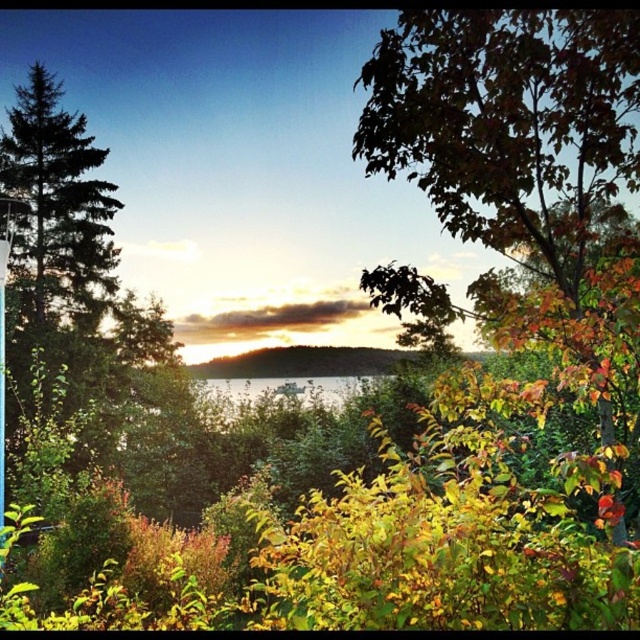
Question: Which point is farther from the camera taking this photo?

Choices:
 (A) (230, 403)
 (B) (433, 60)

Answer: (A)

Question: In this image, where is autumn leaves at right located relative to clear water at center?

Choices:
 (A) above
 (B) below

Answer: (A)

Question: Does autumn leaves at right have a smaller size compared to clear water at center?

Choices:
 (A) yes
 (B) no

Answer: (A)

Question: Which of the following is the farthest from the observer?

Choices:
 (A) autumn leaves at right
 (B) clear water at center

Answer: (B)

Question: In this image, where is autumn leaves at right located relative to clear water at center?

Choices:
 (A) right
 (B) left

Answer: (A)